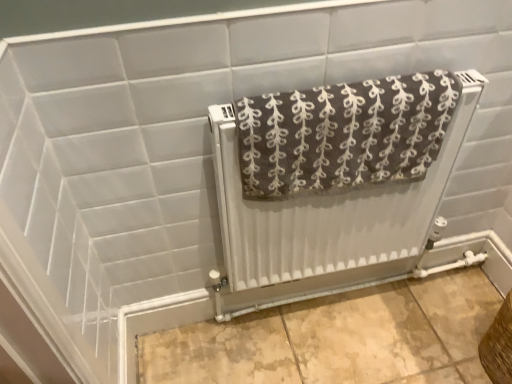
Question: In terms of height, does brown textured towel at center look taller or shorter compared to white textured radiator at center?

Choices:
 (A) tall
 (B) short

Answer: (B)

Question: Do you think brown textured towel at center is within white textured radiator at center, or outside of it?

Choices:
 (A) inside
 (B) outside

Answer: (A)

Question: Which object is the farthest from the brown woven basket at lower right?

Choices:
 (A) white textured radiator at center
 (B) brown textured towel at center

Answer: (B)

Question: Which of these objects is positioned closest to the brown textured towel at center?

Choices:
 (A) white textured radiator at center
 (B) brown woven basket at lower right

Answer: (A)